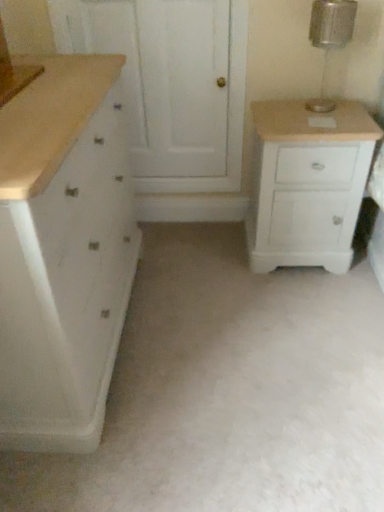
Question: Based on their positions, is white painted wood cabinet at right, which is the first chest of drawers in right-to-left order, located to the left or right of white matte chest of drawers at left, the 2th chest of drawers when ordered from right to left?

Choices:
 (A) right
 (B) left

Answer: (A)

Question: From the image's perspective, is white painted wood cabinet at right, the 2th chest of drawers positioned from the left, above or below white matte chest of drawers at left, the 2th chest of drawers when ordered from right to left?

Choices:
 (A) above
 (B) below

Answer: (A)

Question: Estimate the real-world distances between objects in this image. Which object is farther from the white matte chest of drawers at left, the 2th chest of drawers when ordered from right to left?

Choices:
 (A) metallic glass lamp at upper right
 (B) white wood screen door at upper center
 (C) white painted wood cabinet at right, the 2th chest of drawers positioned from the left

Answer: (A)

Question: Based on their relative distances, which object is farther from the white painted wood cabinet at right, which is the first chest of drawers in right-to-left order?

Choices:
 (A) white matte chest of drawers at left, the 2th chest of drawers when ordered from right to left
 (B) white wood screen door at upper center
 (C) metallic glass lamp at upper right

Answer: (A)